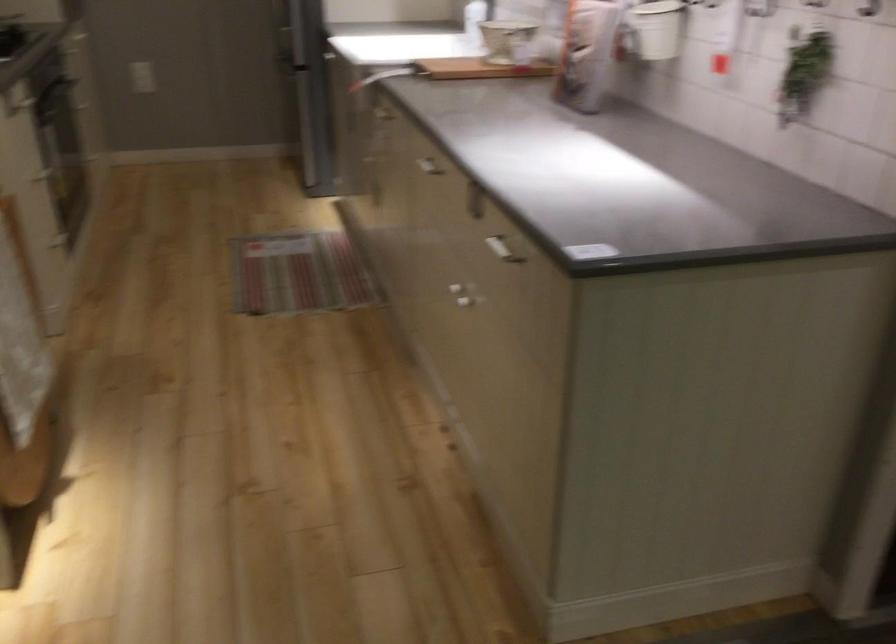
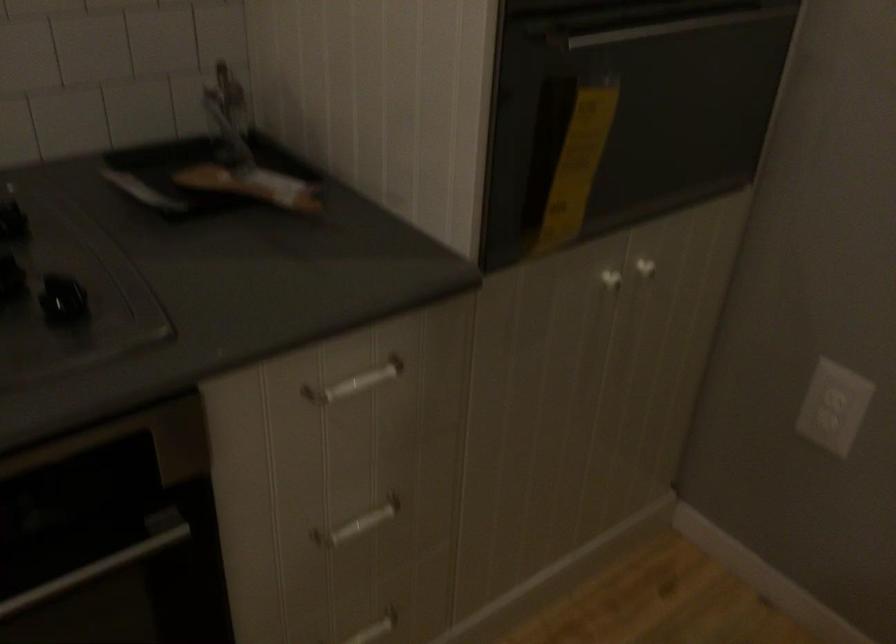
Find the pixel in the second image that matches (x=92, y=114) in the first image.

(358, 524)